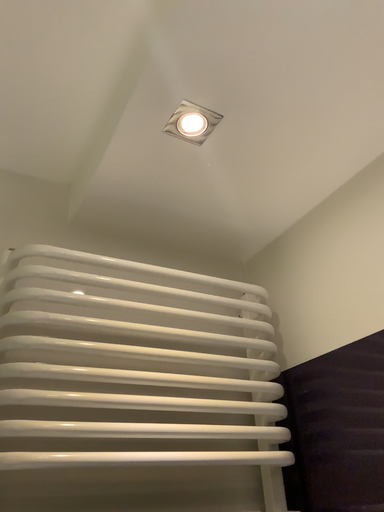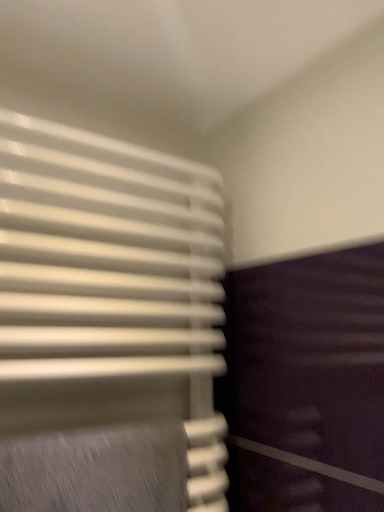
Question: Which way did the camera rotate in the video?

Choices:
 (A) rotated downward
 (B) rotated upward

Answer: (A)